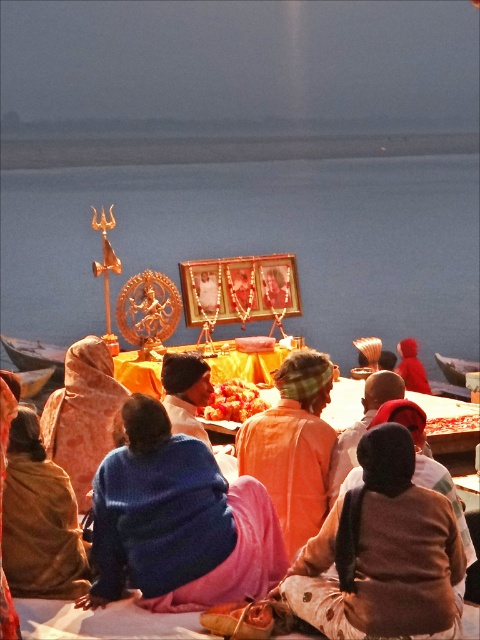
You are a photographer trying to capture a clear shot of both the velvet blue shawl at lower left and the orange cotton robe at center. Since you want to ensure both are visible in your frame, which object should you focus on first to account for their sizes?

The velvet blue shawl at lower left is much taller than the orange cotton robe at center, so you should focus on the velvet blue shawl at lower left first as it occupies more vertical space in the frame.

You are a photographer trying to capture a closeup of the orange fabric cloth at center without moving any objects. Since the blue woolen sweater at lower left is in the way, can you slide it aside? Explain why or why not based on their sizes.

The blue woolen sweater at lower left is thinner than orange fabric cloth at center. Since the sweater is thinner, it can be easily slid aside to access the orange fabric cloth at center without disturbing the setup.

You are a photographer standing in the scene and want to take a photo of both point (370, 614) and point (60, 531). Which point will appear larger in the photo?

Point (370, 614) is closer to the viewer than point (60, 531), so it will appear larger in the photo.